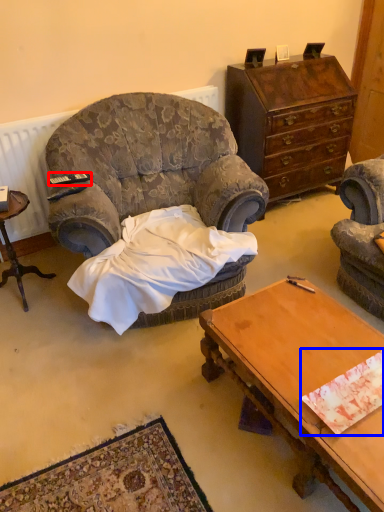
Question: Among these objects, which one is nearest to the camera, remote control (highlighted by a red box) or sheet (highlighted by a blue box)?

Choices:
 (A) remote control
 (B) sheet

Answer: (B)